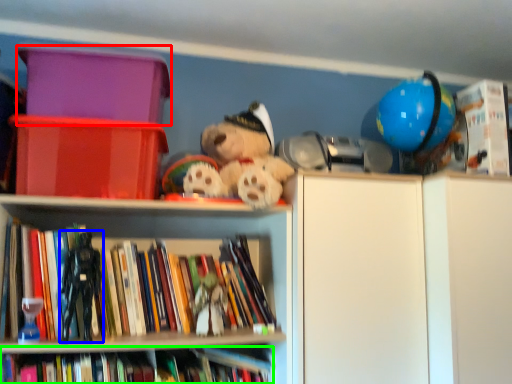
Question: Estimate the real-world distances between objects in this image. Which object is closer to storage box (highlighted by a red box), figurine (highlighted by a blue box) or book (highlighted by a green box)?

Choices:
 (A) figurine
 (B) book

Answer: (A)